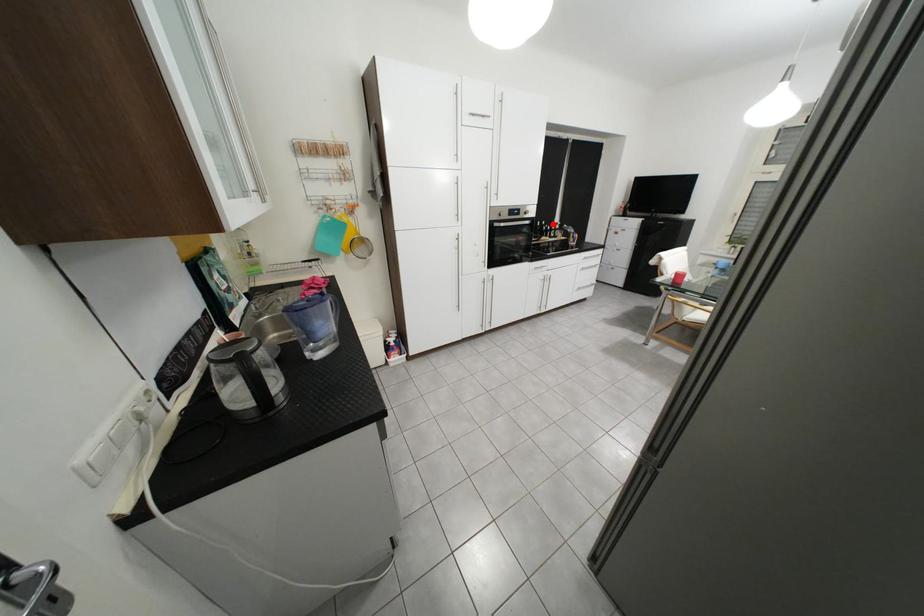
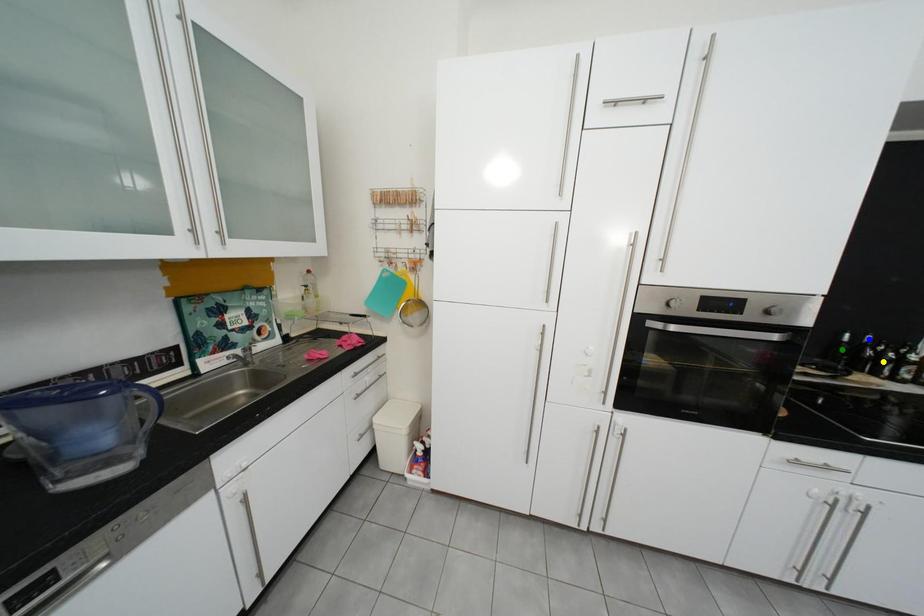
Question: I am providing you with two images of the same scene from different viewpoints. A red point is marked on the first image. You are given multiple points on the second image. Can you choose the point in image 2 that corresponds to the point in image 1?

Choices:
 (A) blue point
 (B) yellow point
 (C) green point

Answer: (A)